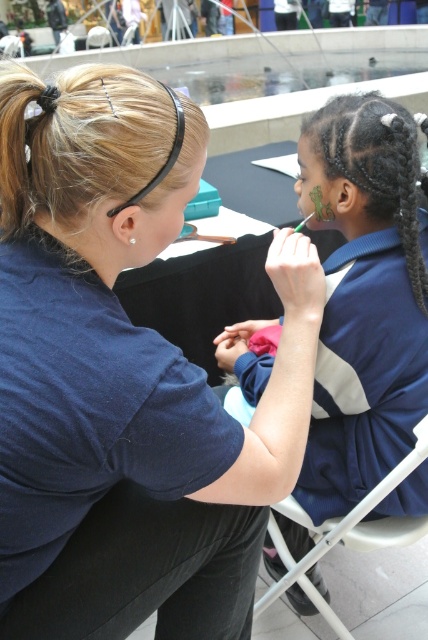
Is matte blue shirt at center closer to the viewer compared to blue fabric shirt at upper right?

Yes, matte blue shirt at center is closer to the viewer.

Which is behind, point (38, 506) or point (339, 420)?

Point (339, 420)

Where is `matte blue shirt at center`? This screenshot has height=640, width=428. matte blue shirt at center is located at coordinates (125, 378).

Looking at this image, is blue fabric shirt at upper right below white plastic chair at lower right?

Incorrect, blue fabric shirt at upper right is not positioned below white plastic chair at lower right.

Does point (353, 104) come behind point (290, 509)?

That is False.

Locate an element on the screen. This screenshot has height=640, width=428. blue fabric shirt at upper right is located at coordinates [x=365, y=298].

How far apart are matte blue shirt at center and white plastic chair at lower right?

The distance of matte blue shirt at center from white plastic chair at lower right is 15.04 inches.

Which is more to the right, matte blue shirt at center or white plastic chair at lower right?

Positioned to the right is white plastic chair at lower right.

Find the location of `matte blue shirt at center`. matte blue shirt at center is located at coordinates (125, 378).

Identify the location of matte blue shirt at center. (125, 378).